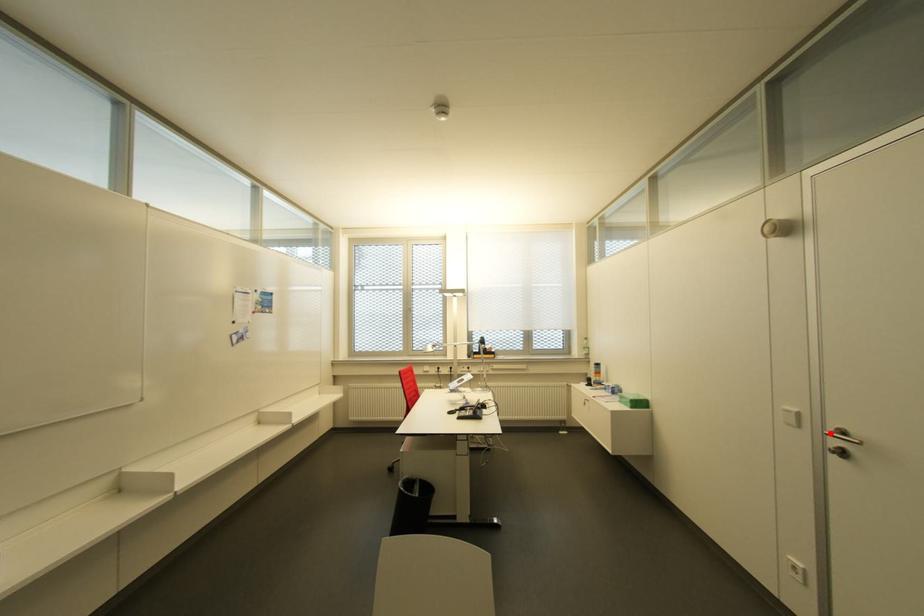
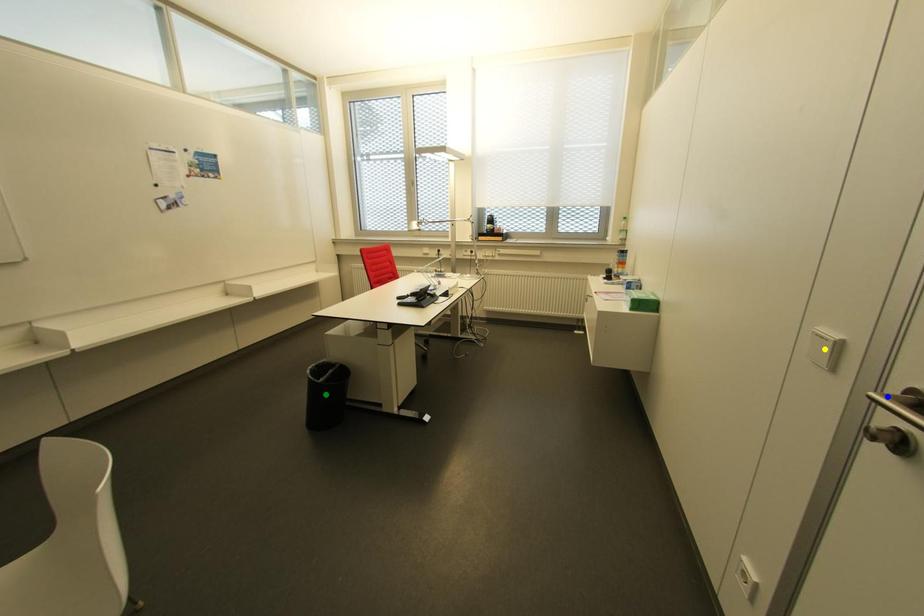
Question: I am providing you with two images of the same scene from different viewpoints. A red point is marked on the first image. You are given multiple points on the second image. Which mark in image 2 goes with the point in image 1?

Choices:
 (A) blue point
 (B) yellow point
 (C) green point

Answer: (A)